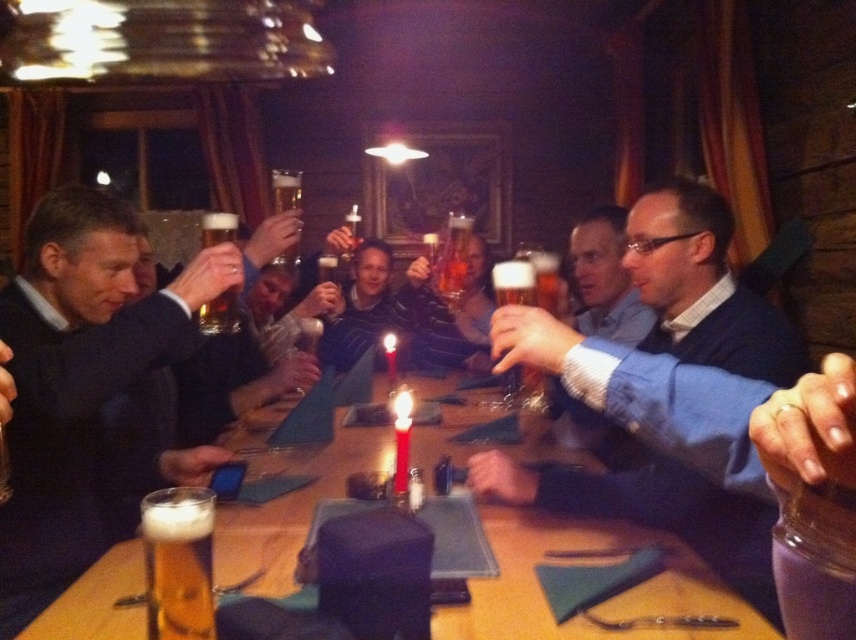
Is matte black suit at left wider than white wax candle at center?

Correct, the width of matte black suit at left exceeds that of white wax candle at center.

Who is taller, matte black suit at left or white wax candle at center?

matte black suit at left is taller.

Who is more distant from viewer, (153, 314) or (396, 470)?

The point (396, 470) is more distant.

Where is `matte black suit at left`? This screenshot has width=856, height=640. matte black suit at left is located at coordinates (91, 388).

Between matte black suit at left and golden frothy beer at lower left, which one appears on the left side from the viewer's perspective?

Positioned to the left is matte black suit at left.

Is point (171, 353) positioned before point (143, 532)?

No, it is not.

Identify the location of matte black suit at left. (91, 388).

Identify the location of matte black suit at left. The height and width of the screenshot is (640, 856). (91, 388).

Consider the image. Does matte black suit at left have a greater width compared to translucent glass beer at center?

Correct, the width of matte black suit at left exceeds that of translucent glass beer at center.

Between point (40, 554) and point (274, 205), which one is positioned in front?

Point (40, 554) is more forward.

Locate an element on the screen. The height and width of the screenshot is (640, 856). matte black suit at left is located at coordinates (91, 388).